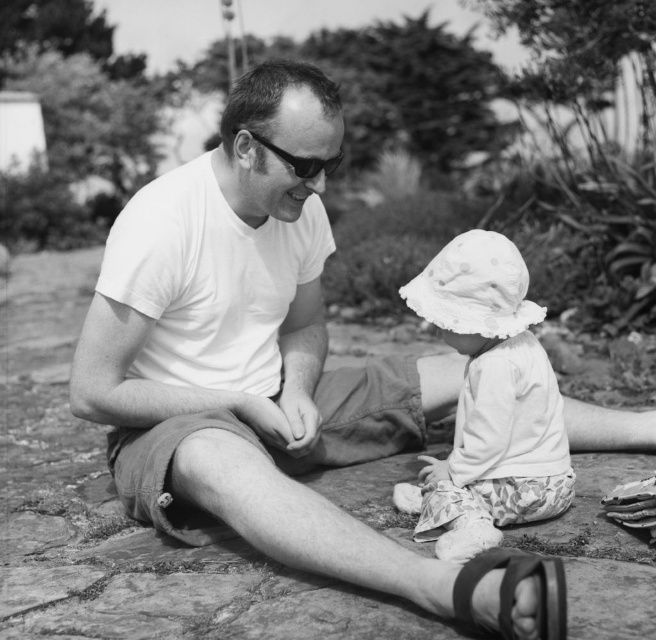
Does black leather sandal at lower center have a smaller size compared to black plastic goggles at center?

Correct, black leather sandal at lower center occupies less space than black plastic goggles at center.

From the picture: Who is more distant from viewer, (560,621) or (304,163)?

The point (304,163) is behind.

I want to click on black leather sandal at lower center, so click(514, 589).

Which is behind, point (478, 413) or point (518, 557)?

The point (478, 413) is behind.

Is point (426, 316) more distant than point (550, 611)?

Yes, point (426, 316) is farther from viewer.

Is point (546, 460) behind point (558, 616)?

Yes, point (546, 460) is behind point (558, 616).

In order to click on white dotted fabric hat at center in this screenshot , I will do `click(489, 400)`.

Describe the element at coordinates (489, 400) in the screenshot. The image size is (656, 640). I see `white dotted fabric hat at center` at that location.

Which of these two, white dotted fabric hat at center or black plastic goggles at center, stands taller?

Standing taller between the two is white dotted fabric hat at center.

Where is `white dotted fabric hat at center`? white dotted fabric hat at center is located at coordinates (489, 400).